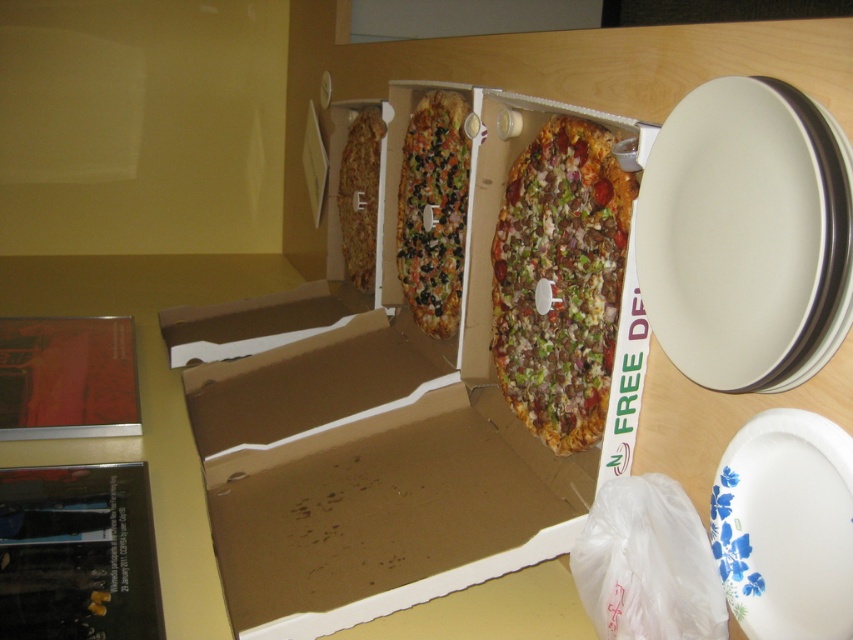
Is white glossy plate at upper right taller than crusty pizza slice at center?

No, white glossy plate at upper right is not taller than crusty pizza slice at center.

Between white glossy plate at upper right and crusty pizza slice at center, which one is positioned lower?

white glossy plate at upper right

Which is in front, point (737, 209) or point (347, 186)?

Positioned in front is point (737, 209).

Where is `white glossy plate at upper right`? This screenshot has width=853, height=640. white glossy plate at upper right is located at coordinates (741, 232).

The width and height of the screenshot is (853, 640). Describe the element at coordinates (560, 280) in the screenshot. I see `crusty pizza at center` at that location.

This screenshot has height=640, width=853. What do you see at coordinates (560, 280) in the screenshot? I see `crusty pizza at center` at bounding box center [560, 280].

This screenshot has width=853, height=640. Find the location of `crusty pizza at center`. crusty pizza at center is located at coordinates (560, 280).

Is brown cardboard box at center wider than multicolored vegetable pizza at center?

Correct, the width of brown cardboard box at center exceeds that of multicolored vegetable pizza at center.

Is point (236, 458) farther from viewer compared to point (428, 198)?

No, (236, 458) is closer to viewer.

I want to click on brown cardboard box at center, so click(398, 428).